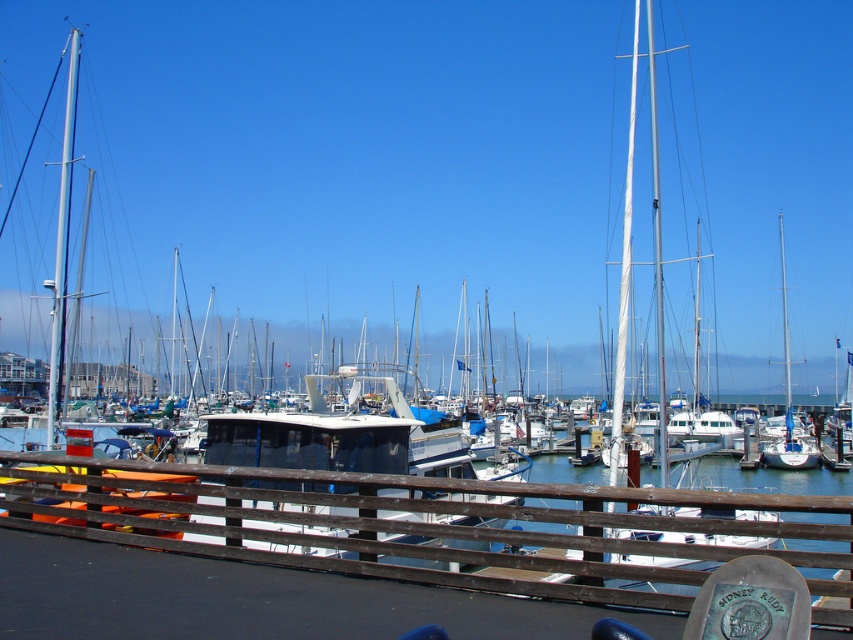
Question: Is white matte sailboat at center to the left of silver metallic mast at left from the viewer's perspective?

Choices:
 (A) no
 (B) yes

Answer: (A)

Question: Which of the following is the closest to the observer?

Choices:
 (A) (70, 179)
 (B) (663, 468)

Answer: (B)

Question: Which object is closer to the camera taking this photo?

Choices:
 (A) white matte sailboat at center
 (B) silver metallic mast at left

Answer: (A)

Question: Does white matte sailboat at center have a lesser width compared to silver metallic mast at left?

Choices:
 (A) no
 (B) yes

Answer: (B)

Question: Can you confirm if white matte sailboat at center is positioned above silver metallic mast at left?

Choices:
 (A) yes
 (B) no

Answer: (A)